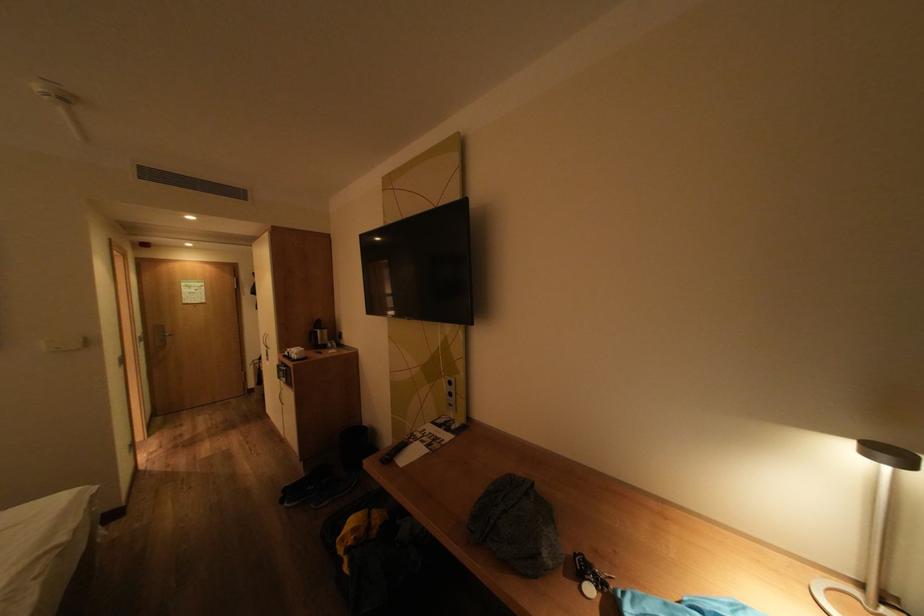
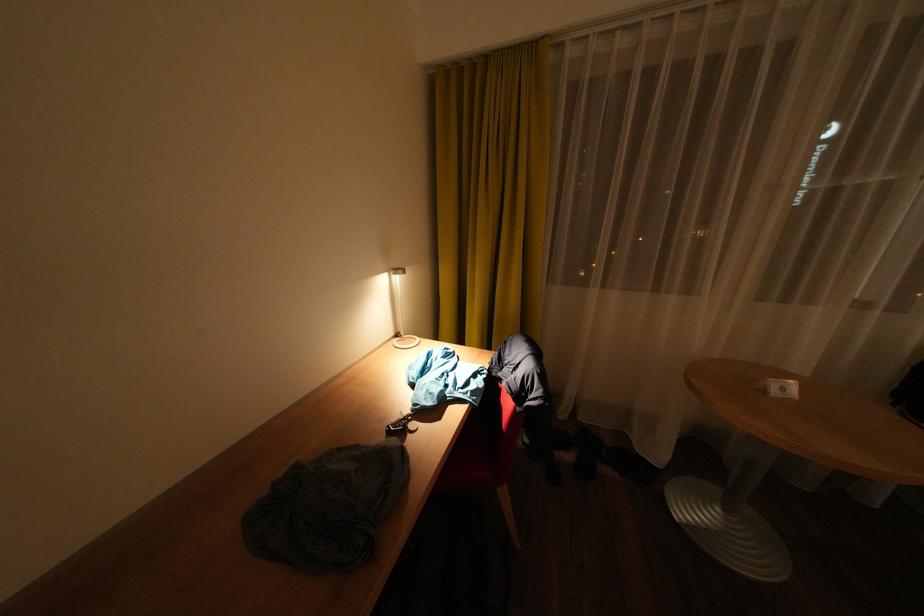
The point at (584, 554) is marked in the first image. Where is the corresponding point in the second image?

(395, 436)